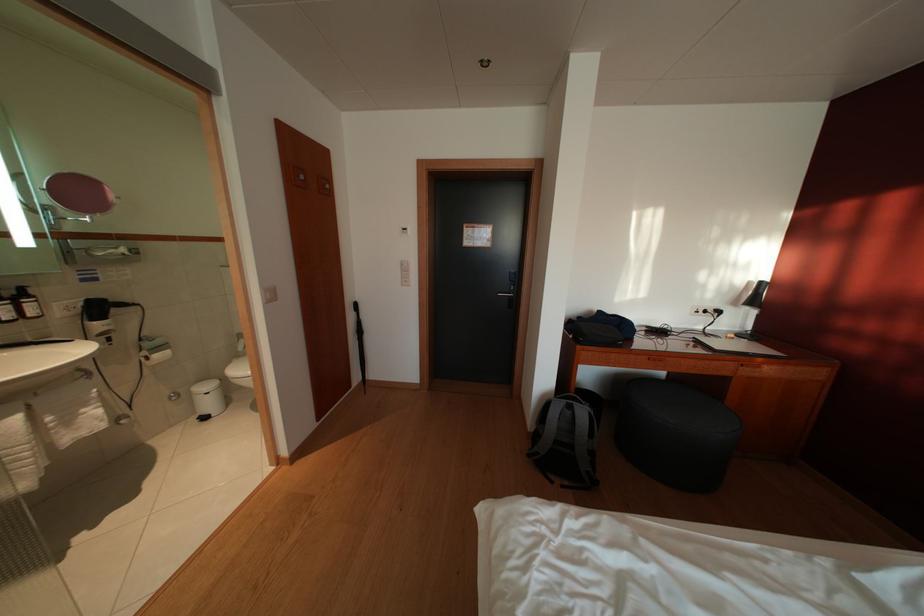
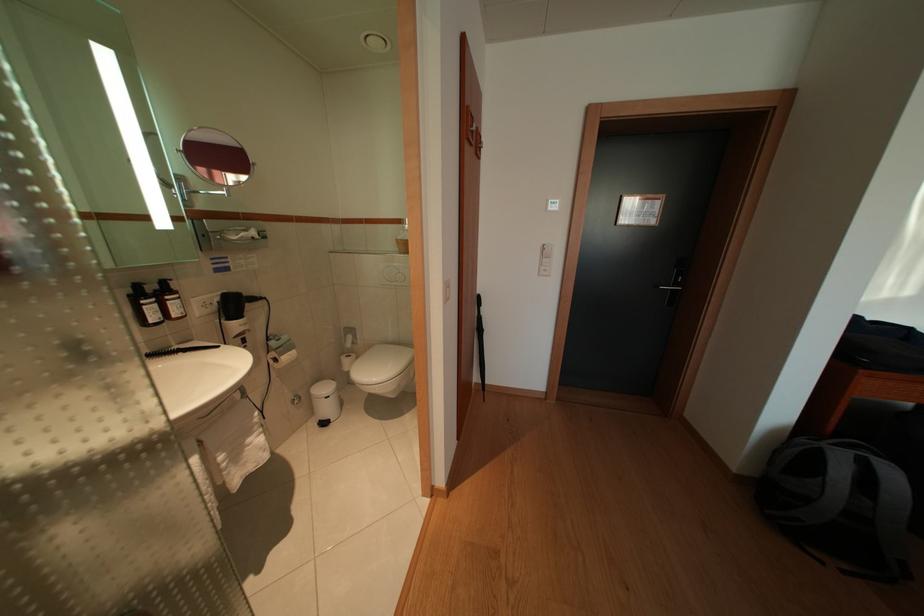
Locate, in the second image, the point that corresponds to (216,410) in the first image.

(335, 415)